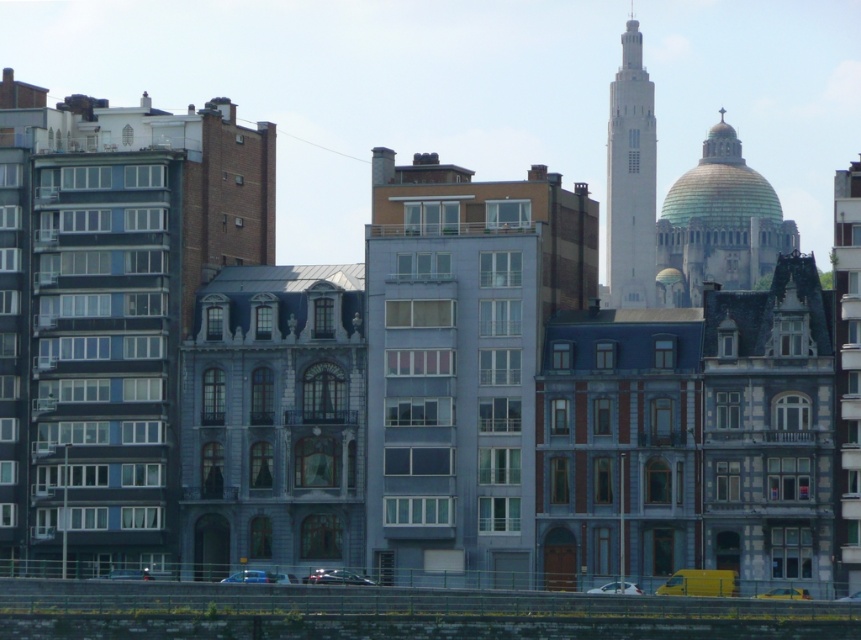
Question: Which point appears farthest from the camera in this image?

Choices:
 (A) (319, 568)
 (B) (847, 600)
 (C) (243, 577)

Answer: (A)

Question: Where is metallic blue car at center located in relation to white glossy car at lower center in the image?

Choices:
 (A) above
 (B) below

Answer: (A)

Question: Which point is farther to the camera?

Choices:
 (A) white glossy car at lower center
 (B) white smooth tower at center
 (C) metallic silver car at lower center
 (D) gold domed dome at upper right

Answer: (D)

Question: Is white glossy car at lower center bigger than yellow matte car at lower right?

Choices:
 (A) yes
 (B) no

Answer: (B)

Question: Based on their relative distances, which object is farther from the shiny black car at center?

Choices:
 (A) white smooth tower at center
 (B) metallic blue car at center
 (C) metallic silver car at lower center

Answer: (A)

Question: Is gold domed dome at upper right to the right of metallic silver car at lower center from the viewer's perspective?

Choices:
 (A) yes
 (B) no

Answer: (A)